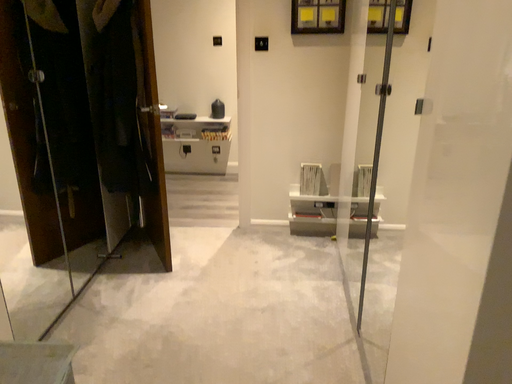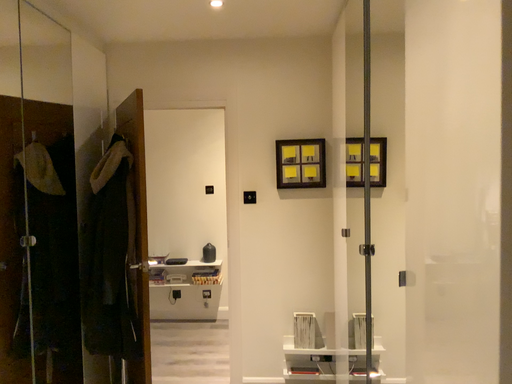
Question: How did the camera likely rotate when shooting the video?

Choices:
 (A) rotated upward
 (B) rotated downward

Answer: (A)